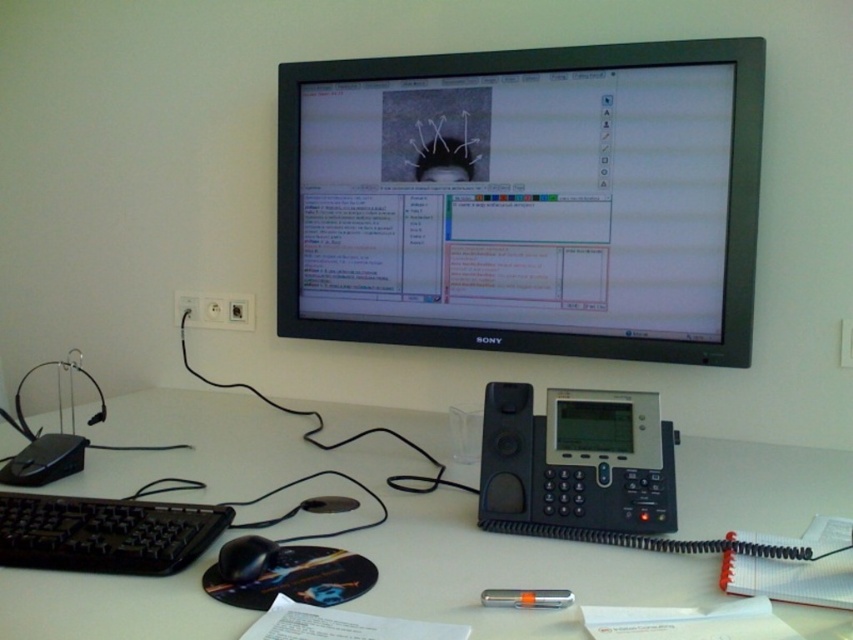
Which is in front, point (1, 515) or point (483, 436)?

Positioned in front is point (1, 515).

Can you confirm if black plastic keyboard at lower left is positioned above black plastic speaker at center?

Incorrect, black plastic keyboard at lower left is not positioned above black plastic speaker at center.

Image resolution: width=853 pixels, height=640 pixels. I want to click on black plastic keyboard at lower left, so click(x=105, y=532).

You are a GUI agent. You are given a task and a screenshot of the screen. Output one action in this format:
    pyautogui.click(x=<x>, y=<y>)
    Task: Click on the black plastic keyboard at lower left
    The width and height of the screenshot is (853, 640).
    Given the screenshot: What is the action you would take?
    pyautogui.click(x=105, y=532)

Can you confirm if black glossy monitor at upper center is positioned above white matte table at center?

Yes, black glossy monitor at upper center is above white matte table at center.

Which is above, black glossy monitor at upper center or white matte table at center?

black glossy monitor at upper center is above.

This screenshot has width=853, height=640. I want to click on black glossy monitor at upper center, so click(x=525, y=198).

Is point (723, 291) less distant than point (53, 499)?

No, it is not.

Does black glossy monitor at upper center appear on the left side of black plastic keyboard at lower left?

No, black glossy monitor at upper center is not to the left of black plastic keyboard at lower left.

This screenshot has width=853, height=640. What do you see at coordinates (525, 198) in the screenshot? I see `black glossy monitor at upper center` at bounding box center [525, 198].

Where is `black glossy monitor at upper center`? This screenshot has height=640, width=853. black glossy monitor at upper center is located at coordinates (525, 198).